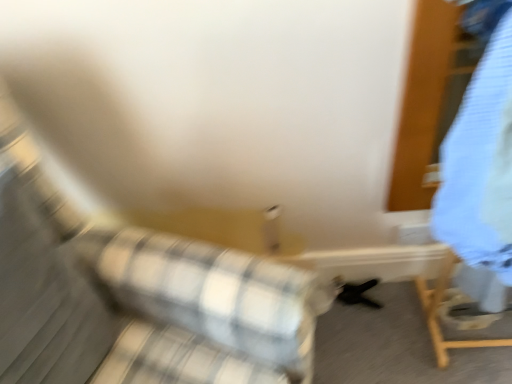
What do you see at coordinates (481, 165) in the screenshot? This screenshot has height=384, width=512. I see `light blue fabric at right` at bounding box center [481, 165].

Locate an element on the screen. The image size is (512, 384). light blue fabric at right is located at coordinates (481, 165).

What is the approximate width of plaid fabric couch at center?

plaid fabric couch at center is 81.94 centimeters wide.

This screenshot has height=384, width=512. What do you see at coordinates (136, 295) in the screenshot?
I see `plaid fabric couch at center` at bounding box center [136, 295].

You are a GUI agent. You are given a task and a screenshot of the screen. Output one action in this format:
    pyautogui.click(x=<x>, y=<y>)
    Task: Click on the plaid fabric couch at center
    
    Given the screenshot: What is the action you would take?
    pyautogui.click(x=136, y=295)

What are the coordinates of `light blue fabric at right` in the screenshot? It's located at (481, 165).

Between light blue fabric at right and plaid fabric couch at center, which one appears on the left side from the viewer's perspective?

From the viewer's perspective, plaid fabric couch at center appears more on the left side.

Considering their positions, is light blue fabric at right located in front of or behind plaid fabric couch at center?

Clearly, light blue fabric at right is behind plaid fabric couch at center.

Between point (499, 111) and point (214, 264), which one is positioned behind?

Point (214, 264)

From the image's perspective, is light blue fabric at right above or below plaid fabric couch at center?

Clearly, from the image's perspective, light blue fabric at right is above plaid fabric couch at center.

From a real-world perspective, which is physically above, light blue fabric at right or plaid fabric couch at center?

light blue fabric at right, from a real-world perspective.

Considering the sizes of objects light blue fabric at right and plaid fabric couch at center in the image provided, who is wider, light blue fabric at right or plaid fabric couch at center?

plaid fabric couch at center is wider.

Considering the sizes of light blue fabric at right and plaid fabric couch at center in the image, is light blue fabric at right taller or shorter than plaid fabric couch at center?

In the image, light blue fabric at right appears to be shorter than plaid fabric couch at center.

Can you confirm if light blue fabric at right is bigger than plaid fabric couch at center?

Actually, light blue fabric at right might be smaller than plaid fabric couch at center.

Is light blue fabric at right inside the boundaries of plaid fabric couch at center, or outside?

light blue fabric at right is not inside plaid fabric couch at center, it's outside.

Can you see light blue fabric at right touching plaid fabric couch at center?

They are not placed beside each other.

Is light blue fabric at right oriented away from plaid fabric couch at center?

light blue fabric at right is not turned away from plaid fabric couch at center.

Can you tell me how much light blue fabric at right and plaid fabric couch at center differ in facing direction?

The angle between the facing direction of light blue fabric at right and the facing direction of plaid fabric couch at center is 68 degrees.

Locate an element on the screen. clothing that appears on the right of plaid fabric couch at center is located at coordinates (481, 165).

Considering the relative positions of plaid fabric couch at center and light blue fabric at right in the image provided, is plaid fabric couch at center to the left of light blue fabric at right from the viewer's perspective?

Yes.

Is plaid fabric couch at center positioned behind light blue fabric at right?

That is False.

Is point (216, 320) in front of point (499, 187)?

That is False.

From the image's perspective, is plaid fabric couch at center located beneath light blue fabric at right?

Yes, from the image's perspective, plaid fabric couch at center is beneath light blue fabric at right.

From a real-world perspective, which object stands above the other?

light blue fabric at right, from a real-world perspective.

Considering the sizes of objects plaid fabric couch at center and light blue fabric at right in the image provided, who is thinner, plaid fabric couch at center or light blue fabric at right?

light blue fabric at right.

In terms of height, does plaid fabric couch at center look taller or shorter compared to light blue fabric at right?

Considering their sizes, plaid fabric couch at center has more height than light blue fabric at right.

Who is smaller, plaid fabric couch at center or light blue fabric at right?

light blue fabric at right.

Is plaid fabric couch at center not within light blue fabric at right?

Yes, plaid fabric couch at center is not within light blue fabric at right.

Is plaid fabric couch at center positioned far away from light blue fabric at right?

Actually, plaid fabric couch at center and light blue fabric at right are a little close together.

Is plaid fabric couch at center looking in the opposite direction of light blue fabric at right?

That's not correct — plaid fabric couch at center is not looking away from light blue fabric at right.

Can you tell me how much plaid fabric couch at center and light blue fabric at right differ in facing direction?

68 degrees separate the facing orientations of plaid fabric couch at center and light blue fabric at right.

Measure the distance between plaid fabric couch at center and light blue fabric at right.

The distance of plaid fabric couch at center from light blue fabric at right is 55.12 centimeters.

The image size is (512, 384). Identify the location of couch on the left side of light blue fabric at right. (136, 295).

Where is `clothing above the plaid fabric couch at center (from a real-world perspective)`? The image size is (512, 384). clothing above the plaid fabric couch at center (from a real-world perspective) is located at coordinates (481, 165).

Locate an element on the screen. clothing that appears behind the plaid fabric couch at center is located at coordinates (481, 165).